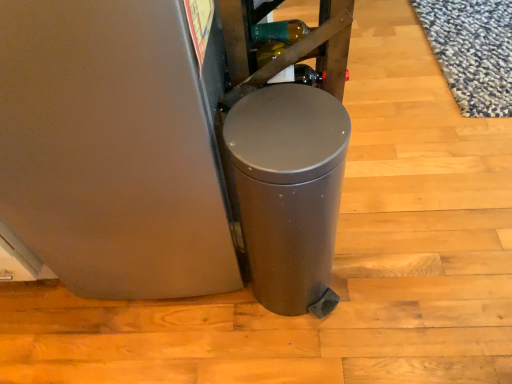
Question: Is satin metallic trash can at center positioned behind metallic brown shelf at upper center?

Choices:
 (A) yes
 (B) no

Answer: (B)

Question: Does satin metallic trash can at center come in front of metallic brown shelf at upper center?

Choices:
 (A) yes
 (B) no

Answer: (A)

Question: From the image's perspective, would you say satin metallic trash can at center is positioned over metallic brown shelf at upper center?

Choices:
 (A) yes
 (B) no

Answer: (B)

Question: Does satin metallic trash can at center have a lesser height compared to metallic brown shelf at upper center?

Choices:
 (A) no
 (B) yes

Answer: (A)

Question: Is satin metallic trash can at center facing towards metallic brown shelf at upper center?

Choices:
 (A) yes
 (B) no

Answer: (B)

Question: Considering the relative sizes of satin metallic trash can at center and metallic brown shelf at upper center in the image provided, is satin metallic trash can at center bigger than metallic brown shelf at upper center?

Choices:
 (A) no
 (B) yes

Answer: (B)

Question: Can you confirm if metallic brown shelf at upper center is shorter than satin metallic trash can at center?

Choices:
 (A) no
 (B) yes

Answer: (B)

Question: From a real-world perspective, is metallic brown shelf at upper center on top of satin metallic trash can at center?

Choices:
 (A) yes
 (B) no

Answer: (A)

Question: Would you say metallic brown shelf at upper center contains satin metallic trash can at center?

Choices:
 (A) no
 (B) yes

Answer: (A)

Question: Considering the relative positions of metallic brown shelf at upper center and satin metallic trash can at center in the image provided, is metallic brown shelf at upper center to the right of satin metallic trash can at center from the viewer's perspective?

Choices:
 (A) no
 (B) yes

Answer: (A)

Question: Would you say metallic brown shelf at upper center is a long distance from satin metallic trash can at center?

Choices:
 (A) no
 (B) yes

Answer: (A)

Question: Considering the relative sizes of metallic brown shelf at upper center and satin metallic trash can at center in the image provided, is metallic brown shelf at upper center bigger than satin metallic trash can at center?

Choices:
 (A) yes
 (B) no

Answer: (B)

Question: From their relative heights in the image, would you say satin metallic trash can at center is taller or shorter than metallic brown shelf at upper center?

Choices:
 (A) tall
 (B) short

Answer: (A)